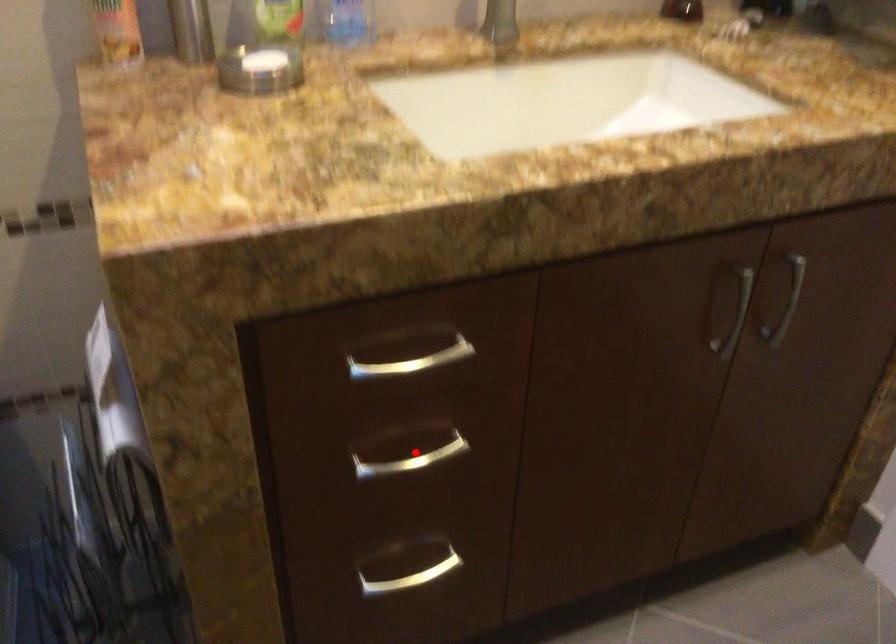
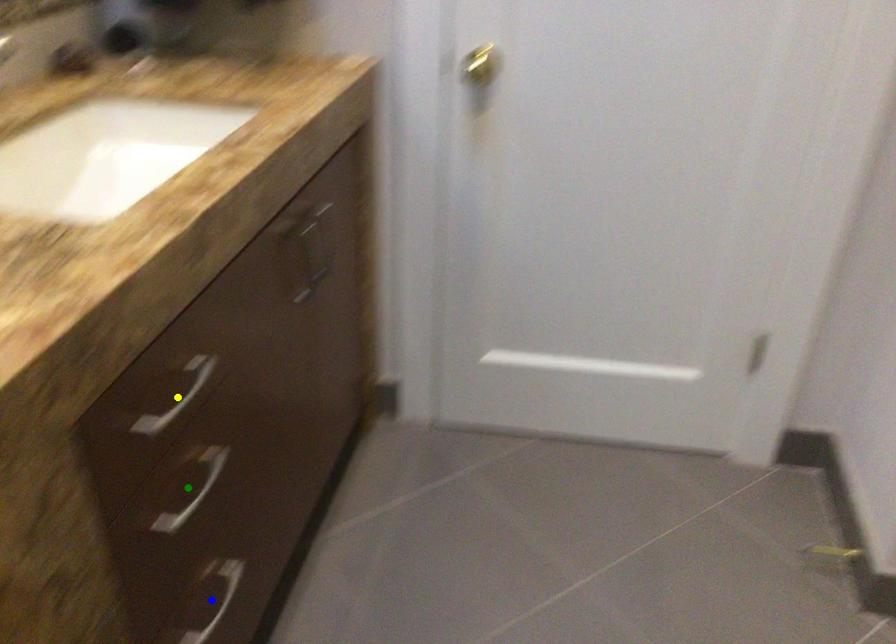
Question: I am providing you with two images of the same scene from different viewpoints. A red point is marked on the first image. You are given multiple points on the second image. Can you choose the point in image 2 that corresponds to the point in image 1?

Choices:
 (A) blue point
 (B) yellow point
 (C) green point

Answer: (C)